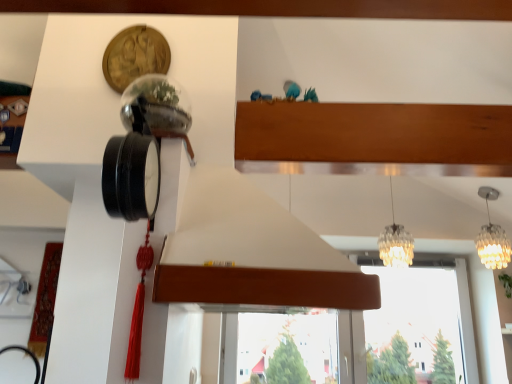
Question: Is translucent glass chandelier at upper right, the 2th lamp when ordered from left to right, at the right side of translucent glass chandelier at center, the 1th lamp in the left-to-right sequence?

Choices:
 (A) yes
 (B) no

Answer: (A)

Question: Can you confirm if translucent glass chandelier at upper right, the 1th lamp in the right-to-left sequence, is smaller than translucent glass chandelier at center, the 1th lamp in the left-to-right sequence?

Choices:
 (A) yes
 (B) no

Answer: (A)

Question: Is translucent glass chandelier at upper right, the 2th lamp when ordered from left to right, outside of translucent glass chandelier at center, the 1th lamp in the left-to-right sequence?

Choices:
 (A) no
 (B) yes

Answer: (B)

Question: Does translucent glass chandelier at upper right, the 1th lamp in the right-to-left sequence, lie behind translucent glass chandelier at center, the 1th lamp in the left-to-right sequence?

Choices:
 (A) no
 (B) yes

Answer: (B)

Question: Considering the relative sizes of translucent glass chandelier at upper right, the 1th lamp in the right-to-left sequence, and translucent glass chandelier at center, the 1th lamp in the left-to-right sequence, in the image provided, is translucent glass chandelier at upper right, the 1th lamp in the right-to-left sequence, wider than translucent glass chandelier at center, the 1th lamp in the left-to-right sequence,?

Choices:
 (A) no
 (B) yes

Answer: (B)

Question: From a real-world perspective, is translucent glass chandelier at upper right, the 2th lamp when ordered from left to right, positioned over translucent glass chandelier at center, placed as the second lamp when sorted from right to left, based on gravity?

Choices:
 (A) no
 (B) yes

Answer: (A)

Question: Is transparent glass window at center closer to camera compared to translucent glass chandelier at center, placed as the second lamp when sorted from right to left?

Choices:
 (A) no
 (B) yes

Answer: (A)

Question: Is transparent glass window at center directly adjacent to translucent glass chandelier at center, the 1th lamp in the left-to-right sequence?

Choices:
 (A) no
 (B) yes

Answer: (A)

Question: Is transparent glass window at center aimed at translucent glass chandelier at center, placed as the second lamp when sorted from right to left?

Choices:
 (A) yes
 (B) no

Answer: (A)

Question: Is transparent glass window at center wider than translucent glass chandelier at center, the 1th lamp in the left-to-right sequence?

Choices:
 (A) yes
 (B) no

Answer: (B)

Question: Can you confirm if transparent glass window at center is taller than translucent glass chandelier at center, placed as the second lamp when sorted from right to left?

Choices:
 (A) yes
 (B) no

Answer: (A)

Question: Is the position of transparent glass window at center more distant than that of translucent glass chandelier at center, the 1th lamp in the left-to-right sequence?

Choices:
 (A) no
 (B) yes

Answer: (B)

Question: Does translucent glass chandelier at center, the 1th lamp in the left-to-right sequence, have a greater width compared to translucent glass chandelier at upper right, the 2th lamp when ordered from left to right?

Choices:
 (A) no
 (B) yes

Answer: (A)